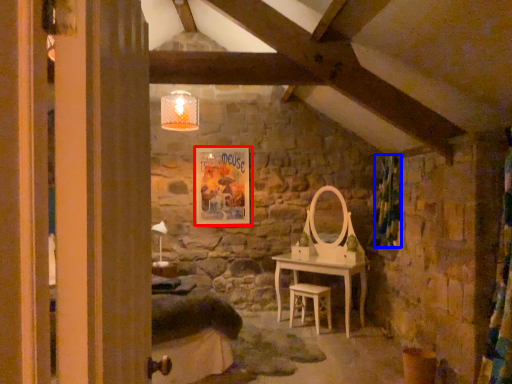
Question: Which object appears farthest to the camera in this image, picture frame (highlighted by a red box) or curtain (highlighted by a blue box)?

Choices:
 (A) picture frame
 (B) curtain

Answer: (A)